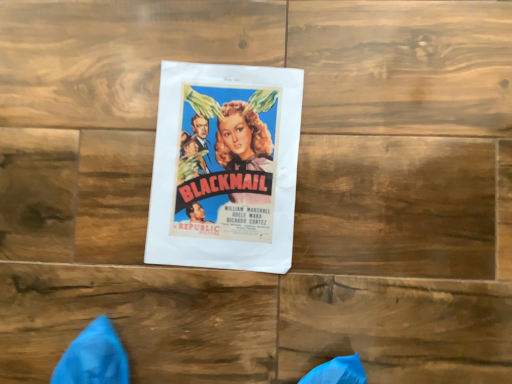
Where is `matte paper poster at center`? Image resolution: width=512 pixels, height=384 pixels. matte paper poster at center is located at coordinates (225, 167).

What do you see at coordinates (225, 167) in the screenshot?
I see `matte paper poster at center` at bounding box center [225, 167].

Find the location of a particular element. matte paper poster at center is located at coordinates (225, 167).